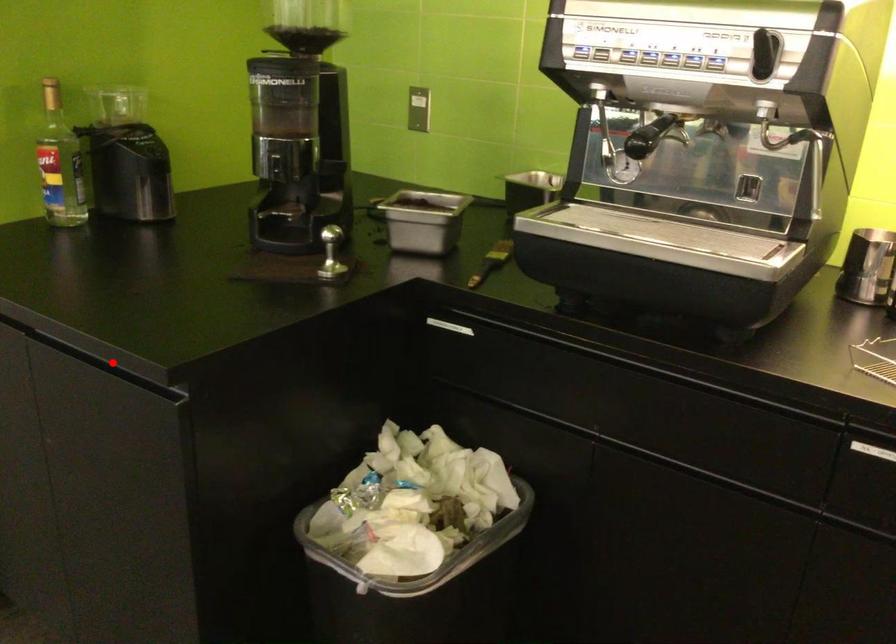
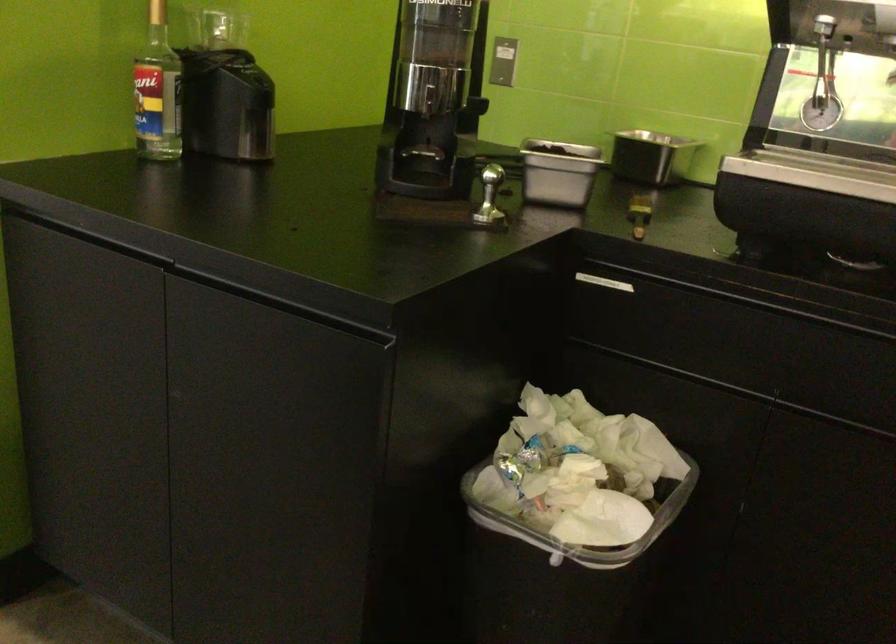
Question: I am providing you with two images of the same scene from different viewpoints. Image1 has a red point marked. In image2, the corresponding 3D location appears at what relative position? Reply with the corresponding letter.

Choices:
 (A) Closer
 (B) Farther

Answer: (A)